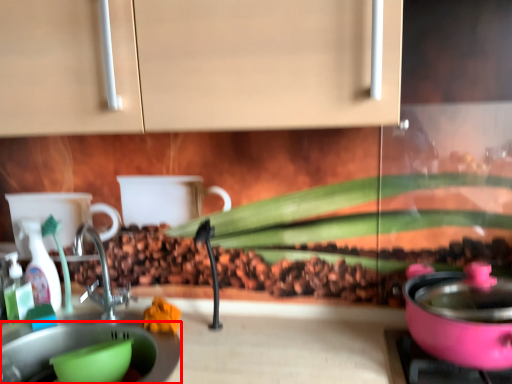
Question: From the image's perspective, what is the correct spatial positioning of sink (annotated by the red box) in reference to bottle?

Choices:
 (A) below
 (B) above

Answer: (A)